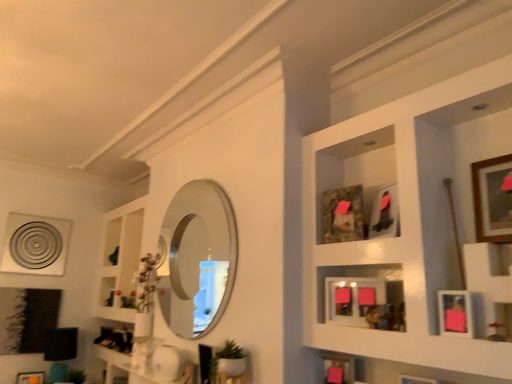
What do you see at coordinates (352, 299) in the screenshot?
I see `matte pink picture frame at center, acting as the fourth picture frame starting from the bottom` at bounding box center [352, 299].

The width and height of the screenshot is (512, 384). I want to click on matte pink picture frame at center, which ranks as the fifth picture frame in top-to-bottom order, so click(352, 299).

In order to face polished silver mirror at center, should I rotate leftwards or rightwards?

Rotate your view left by about 8.921°.

Measure the distance between point (217, 353) and camera.

They are 2.42 meters apart.

Find the location of a particular element. The width and height of the screenshot is (512, 384). camouflage fabric picture frame at center, which is the third picture frame in left-to-right order is located at coordinates (342, 215).

Is point (380, 236) more distant than point (451, 322)?

Yes.

Would you say matte black picture frame at upper center, which is counted as the 4th picture frame, starting from the front, is a long distance from pink matte picture frame at lower right, the fourth picture frame in the top-to-bottom sequence?

They are positioned close to each other.

Measure the distance from matte black picture frame at upper center, marked as the 2th picture frame in a top-to-bottom arrangement, to pink matte picture frame at lower right, the 7th picture frame viewed from the back.

matte black picture frame at upper center, marked as the 2th picture frame in a top-to-bottom arrangement, and pink matte picture frame at lower right, the 7th picture frame viewed from the back, are 16.28 inches apart from each other.

Find the location of `the 2nd picture frame behind the pink matte picture frame at lower right, marked as the 7th picture frame in a left-to-right arrangement, starting your count from the anchor`. the 2nd picture frame behind the pink matte picture frame at lower right, marked as the 7th picture frame in a left-to-right arrangement, starting your count from the anchor is located at coordinates (385, 213).

In terms of width, does wooden picture frames at upper right look wider or thinner when compared to pink matte picture frame at lower right, the fourth picture frame in the top-to-bottom sequence?

wooden picture frames at upper right is wider than pink matte picture frame at lower right, the fourth picture frame in the top-to-bottom sequence.

Starting from the wooden picture frames at upper right, which picture frame is the 1st one to the right? Please provide its 2D coordinates.

[(455, 313)]

Can you confirm if wooden picture frames at upper right is positioned to the right of pink matte picture frame at lower right, the fourth picture frame in the top-to-bottom sequence?

No, wooden picture frames at upper right is not to the right of pink matte picture frame at lower right, the fourth picture frame in the top-to-bottom sequence.

Is wooden picture frames at upper right placed right next to pink matte picture frame at lower right, marked as the 7th picture frame in a left-to-right arrangement?

There is a gap between wooden picture frames at upper right and pink matte picture frame at lower right, marked as the 7th picture frame in a left-to-right arrangement.

Does metallic silver circular object at upper left, which is the 8th picture frame from front to back, have a lesser width compared to wooden framed picture at upper right, which appears as the 8th picture frame when viewed from the back?

In fact, metallic silver circular object at upper left, which is the 8th picture frame from front to back, might be wider than wooden framed picture at upper right, which appears as the 8th picture frame when viewed from the back.

Is metallic silver circular object at upper left, acting as the 3th picture frame starting from the bottom, shorter than wooden framed picture at upper right, the first picture frame from the right?

No.

Is metallic silver circular object at upper left, acting as the first picture frame starting from the back, oriented towards wooden framed picture at upper right, which ranks as the eighth picture frame in bottom-to-top order?

Yes, metallic silver circular object at upper left, acting as the first picture frame starting from the back, faces towards wooden framed picture at upper right, which ranks as the eighth picture frame in bottom-to-top order.

Which object is further away from the camera taking this photo, metallic silver circular object at upper left, the 1th picture frame positioned from the left, or wooden framed picture at upper right, which ranks as the eighth picture frame in bottom-to-top order?

metallic silver circular object at upper left, the 1th picture frame positioned from the left, is further from the camera.

Which picture frame is the 2nd one when counting from the back of the matte pink picture frame at center, placed as the fifth picture frame when sorted from right to left? Please provide its 2D coordinates.

[(30, 378)]

Is matte pink picture frame at center, the fifth picture frame viewed from the front, far from matte orange picture frame at lower left, arranged as the seventh picture frame when viewed from the front?

Absolutely, matte pink picture frame at center, the fifth picture frame viewed from the front, is distant from matte orange picture frame at lower left, arranged as the seventh picture frame when viewed from the front.

Which of these two, matte pink picture frame at center, placed as the 4th picture frame when sorted from back to front, or matte orange picture frame at lower left, the seventh picture frame when ordered from right to left, is thinner?

matte pink picture frame at center, placed as the 4th picture frame when sorted from back to front, is thinner.

Between matte pink picture frame at center, placed as the 4th picture frame when sorted from back to front, and matte orange picture frame at lower left, which is the 2th picture frame in left-to-right order, which one has larger size?

matte orange picture frame at lower left, which is the 2th picture frame in left-to-right order, is bigger.

Which object is thinner, wooden framed picture at upper right, the first picture frame from the right, or pink matte picture frame at lower right, which ranks as the fifth picture frame in bottom-to-top order?

With smaller width is wooden framed picture at upper right, the first picture frame from the right.

Is point (509, 189) less distant than point (459, 320)?

No, it is behind (459, 320).

From a real-world perspective, is wooden framed picture at upper right, which appears as the 8th picture frame when viewed from the back, on pink matte picture frame at lower right, marked as the 7th picture frame in a left-to-right arrangement?

Yes.

What's the angular difference between wooden framed picture at upper right, which appears as the 8th picture frame when viewed from the back, and pink matte picture frame at lower right, acting as the second picture frame starting from the right,'s facing directions?

wooden framed picture at upper right, which appears as the 8th picture frame when viewed from the back, and pink matte picture frame at lower right, acting as the second picture frame starting from the right, are facing 0.763 degrees away from each other.

Can you confirm if matte black picture frame at upper center, marked as the 2th picture frame in a top-to-bottom arrangement, is wider than camouflage fabric picture frame at center, which ranks as the 6th picture frame in right-to-left order?

Correct, the width of matte black picture frame at upper center, marked as the 2th picture frame in a top-to-bottom arrangement, exceeds that of camouflage fabric picture frame at center, which ranks as the 6th picture frame in right-to-left order.

Is matte black picture frame at upper center, placed as the 5th picture frame when sorted from left to right, turned away from camouflage fabric picture frame at center, which ranks as the 6th picture frame in front-to-back order?

No, camouflage fabric picture frame at center, which ranks as the 6th picture frame in front-to-back order, is not at the back of matte black picture frame at upper center, placed as the 5th picture frame when sorted from left to right.

Considering the relative positions of matte black picture frame at upper center, the 5th picture frame viewed from the back, and camouflage fabric picture frame at center, which is the third picture frame in left-to-right order, in the image provided, is matte black picture frame at upper center, the 5th picture frame viewed from the back, to the left or to the right of camouflage fabric picture frame at center, which is the third picture frame in left-to-right order,?

Based on their positions, matte black picture frame at upper center, the 5th picture frame viewed from the back, is located to the right of camouflage fabric picture frame at center, which is the third picture frame in left-to-right order.

Is point (396, 207) positioned behind point (362, 210)?

That is False.

Between wooden picture frames at upper right and wooden picture frame at lower right, the 3th picture frame viewed from the right, which one has larger size?

With larger size is wooden picture frames at upper right.

How far apart are wooden picture frames at upper right and wooden picture frame at lower right, marked as the 7th picture frame in a top-to-bottom arrangement?

The distance of wooden picture frames at upper right from wooden picture frame at lower right, marked as the 7th picture frame in a top-to-bottom arrangement, is 28.77 inches.

From the image's perspective, between wooden picture frames at upper right and wooden picture frame at lower right, the sixth picture frame in the left-to-right sequence, who is located below?

wooden picture frame at lower right, the sixth picture frame in the left-to-right sequence.

Would you say wooden picture frames at upper right is a long distance from wooden picture frame at lower right, the sixth picture frame in the left-to-right sequence?

No, wooden picture frames at upper right is not far away from wooden picture frame at lower right, the sixth picture frame in the left-to-right sequence.

At what (x,y) coordinates should I click in order to perform the action: click on the 2nd picture frame in front of the matte black picture frame at upper center, marked as the 2th picture frame in a top-to-bottom arrangement, starting your count from the anchor. Please return your answer as a coordinate pair (x, y). The height and width of the screenshot is (384, 512). Looking at the image, I should click on (455, 313).

Image resolution: width=512 pixels, height=384 pixels. In order to click on shelf above the pink matte picture frame at lower right, the 7th picture frame viewed from the back (from the image's perspective) in this screenshot , I will do `click(410, 223)`.

Estimate the real-world distances between objects in this image. Which object is closer to camouflage fabric picture frame at center, which ranks as the 6th picture frame in front-to-back order, matte black picture frame at upper center, placed as the 5th picture frame when sorted from left to right, or polished silver mirror at center?

matte black picture frame at upper center, placed as the 5th picture frame when sorted from left to right, is positioned closer to the anchor camouflage fabric picture frame at center, which ranks as the 6th picture frame in front-to-back order.

Which object lies further to the anchor point polished silver mirror at center, green matte plant at lower center or wooden framed picture at upper right, the first picture frame from the right?

wooden framed picture at upper right, the first picture frame from the right, lies further to polished silver mirror at center than the other object.

Based on the photo, looking at the image, which one is located further to matte black picture frame at upper center, the fourth picture frame in the right-to-left sequence, camouflage fabric picture frame at center, the 3th picture frame from the back, or matte orange picture frame at lower left, which is the 2th picture frame in left-to-right order?

Based on the image, matte orange picture frame at lower left, which is the 2th picture frame in left-to-right order, appears to be further to matte black picture frame at upper center, the fourth picture frame in the right-to-left sequence.

Estimate the real-world distances between objects in this image. Which object is closer to wooden framed picture at upper right, the first picture frame from the right, polished silver mirror at center or wooden picture frames at upper right?

wooden picture frames at upper right lies closer to wooden framed picture at upper right, the first picture frame from the right, than the other object.

From the image, which object appears to be nearer to polished silver mirror at center, matte pink picture frame at center, placed as the fifth picture frame when sorted from right to left, or pink matte picture frame at lower right, which is the 2th picture frame in front-to-back order?

matte pink picture frame at center, placed as the fifth picture frame when sorted from right to left, lies closer to polished silver mirror at center than the other object.

Based on their spatial positions, is matte orange picture frame at lower left, arranged as the seventh picture frame when viewed from the front, or wooden framed picture at upper right, the first picture frame from the right, closer to metallic silver circular object at upper left, the 1th picture frame positioned from the left?

The object closer to metallic silver circular object at upper left, the 1th picture frame positioned from the left, is matte orange picture frame at lower left, arranged as the seventh picture frame when viewed from the front.

Considering their positions, is camouflage fabric picture frame at center, the 3th picture frame from the back, positioned further to pink matte picture frame at lower right, which ranks as the fifth picture frame in bottom-to-top order, than polished silver mirror at center?

polished silver mirror at center is positioned further to the anchor pink matte picture frame at lower right, which ranks as the fifth picture frame in bottom-to-top order.

Looking at the image, which one is located closer to metallic silver circular object at upper left, which is the 8th picture frame from front to back, wooden picture frames at upper right or pink matte picture frame at lower right, acting as the second picture frame starting from the right?

Among the two, wooden picture frames at upper right is located nearer to metallic silver circular object at upper left, which is the 8th picture frame from front to back.

Image resolution: width=512 pixels, height=384 pixels. I want to click on mirror between metallic silver circular object at upper left, the 1th picture frame positioned from the left, and pink matte picture frame at lower right, which ranks as the fifth picture frame in bottom-to-top order, so click(x=198, y=258).

The width and height of the screenshot is (512, 384). In order to click on picture frame between polished silver mirror at center and matte pink picture frame at center, acting as the fourth picture frame starting from the bottom, in the horizontal direction in this screenshot , I will do click(x=342, y=215).

At what (x,y) coordinates should I click in order to perform the action: click on mirror between matte orange picture frame at lower left, arranged as the seventh picture frame when viewed from the front, and wooden picture frame at lower right, the sixth picture frame in the left-to-right sequence, from left to right. Please return your answer as a coordinate pair (x, y). This screenshot has width=512, height=384. Looking at the image, I should click on (198, 258).

At what (x,y) coordinates should I click in order to perform the action: click on mirror situated between matte orange picture frame at lower left, arranged as the seventh picture frame when viewed from the front, and wooden framed picture at upper right, which appears as the 1th picture frame when viewed from the top, from left to right. Please return your answer as a coordinate pair (x, y). Image resolution: width=512 pixels, height=384 pixels. Looking at the image, I should click on (198, 258).